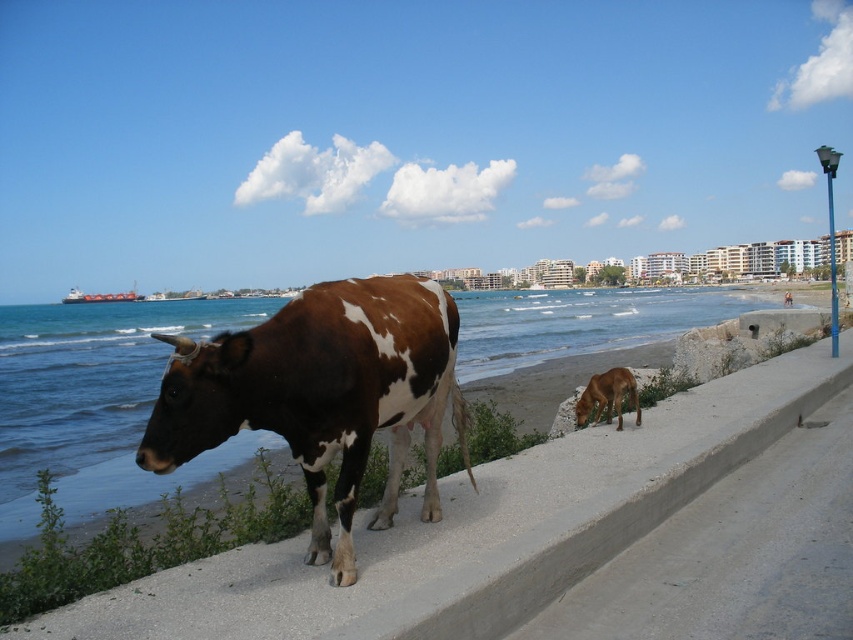
Question: Among these objects, which one is farthest from the camera?

Choices:
 (A) brown glossy water at center
 (B) brown and white speckled cow at center

Answer: (A)

Question: Is brown glossy water at center wider than brown and white speckled cow at center?

Choices:
 (A) yes
 (B) no

Answer: (A)

Question: Does brown glossy water at center have a lesser width compared to brown and white speckled cow at center?

Choices:
 (A) yes
 (B) no

Answer: (B)

Question: Can you confirm if brown glossy water at center is positioned to the right of brown and white speckled cow at center?

Choices:
 (A) no
 (B) yes

Answer: (A)

Question: Which point is closer to the camera taking this photo?

Choices:
 (A) (125, 410)
 (B) (299, 337)

Answer: (B)